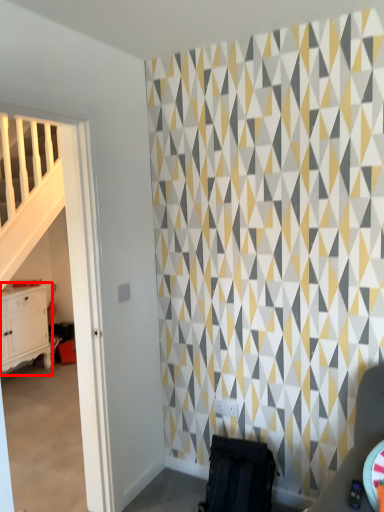
Question: Observing the image, what is the correct spatial positioning of chest of drawers (annotated by the red box) in reference to swivel chair?

Choices:
 (A) right
 (B) left

Answer: (B)